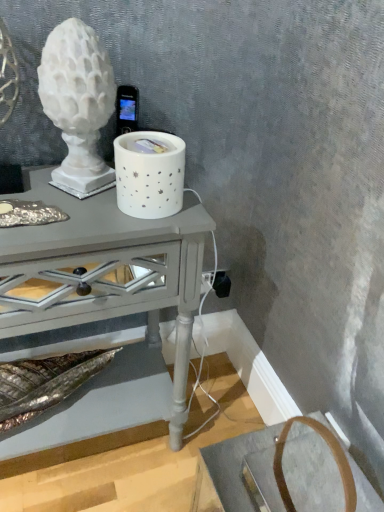
Question: Can you confirm if white ceramic candle holder at center, the 1th candle holder positioned from the right, is bigger than white matte sculpture at upper left, the first candle holder when ordered from left to right?

Choices:
 (A) yes
 (B) no

Answer: (B)

Question: Considering the relative positions of white ceramic candle holder at center, the second candle holder viewed from the left, and white matte sculpture at upper left, the 2th candle holder positioned from the right, in the image provided, is white ceramic candle holder at center, the second candle holder viewed from the left, to the right of white matte sculpture at upper left, the 2th candle holder positioned from the right, from the viewer's perspective?

Choices:
 (A) no
 (B) yes

Answer: (B)

Question: From the image's perspective, is white ceramic candle holder at center, the 1th candle holder positioned from the right, below white matte sculpture at upper left, the 2th candle holder positioned from the right?

Choices:
 (A) yes
 (B) no

Answer: (A)

Question: Is white ceramic candle holder at center, the 1th candle holder positioned from the right, wider than white matte sculpture at upper left, the 2th candle holder positioned from the right?

Choices:
 (A) yes
 (B) no

Answer: (A)

Question: From the image's perspective, is white ceramic candle holder at center, the 1th candle holder positioned from the right, above white matte sculpture at upper left, the first candle holder when ordered from left to right?

Choices:
 (A) no
 (B) yes

Answer: (A)

Question: Considering the relative sizes of white ceramic candle holder at center, the second candle holder viewed from the left, and white matte sculpture at upper left, the first candle holder when ordered from left to right, in the image provided, is white ceramic candle holder at center, the second candle holder viewed from the left, smaller than white matte sculpture at upper left, the first candle holder when ordered from left to right,?

Choices:
 (A) yes
 (B) no

Answer: (A)

Question: Does white matte sculpture at upper left, the first candle holder when ordered from left to right, turn towards black plastic outlet at lower right?

Choices:
 (A) no
 (B) yes

Answer: (A)

Question: From the image's perspective, is white matte sculpture at upper left, the first candle holder when ordered from left to right, on black plastic outlet at lower right?

Choices:
 (A) yes
 (B) no

Answer: (A)

Question: From the image's perspective, is white matte sculpture at upper left, the first candle holder when ordered from left to right, under black plastic outlet at lower right?

Choices:
 (A) yes
 (B) no

Answer: (B)

Question: Is white matte sculpture at upper left, the first candle holder when ordered from left to right, outside black plastic outlet at lower right?

Choices:
 (A) yes
 (B) no

Answer: (A)

Question: Is white matte sculpture at upper left, the first candle holder when ordered from left to right, smaller than black plastic outlet at lower right?

Choices:
 (A) no
 (B) yes

Answer: (A)

Question: Is white matte sculpture at upper left, the first candle holder when ordered from left to right, taller than black plastic outlet at lower right?

Choices:
 (A) no
 (B) yes

Answer: (B)

Question: Would you say matte gray table at center is part of black plastic outlet at lower right's contents?

Choices:
 (A) yes
 (B) no

Answer: (B)